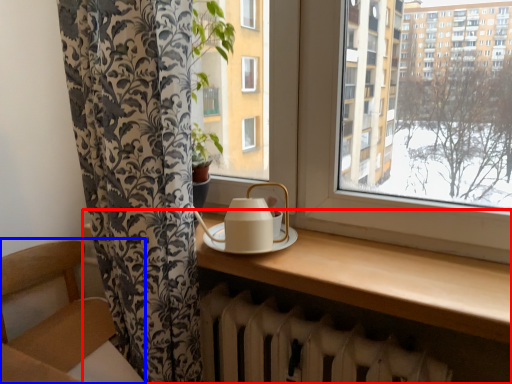
Question: Which of the following is the closest to the observer, table (highlighted by a red box) or armchair (highlighted by a blue box)?

Choices:
 (A) table
 (B) armchair

Answer: (A)